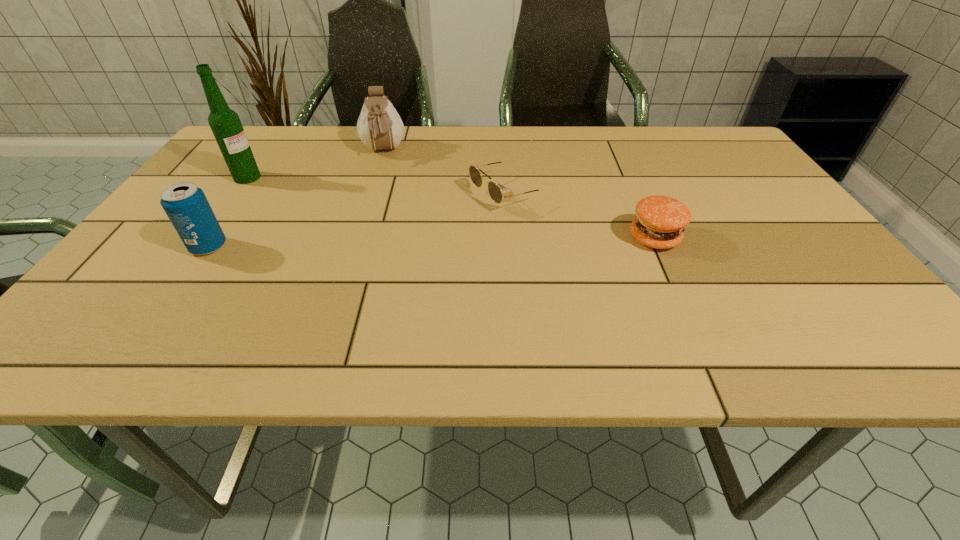
Locate an element on the screen. This screenshot has width=960, height=540. the third shortest object is located at coordinates (185, 204).

Where is `the rightmost object`? The height and width of the screenshot is (540, 960). the rightmost object is located at coordinates (660, 221).

The height and width of the screenshot is (540, 960). Find the location of `sunglasses`. sunglasses is located at coordinates (494, 190).

In order to click on pouch in this screenshot , I will do `click(379, 126)`.

Locate an element on the screen. Image resolution: width=960 pixels, height=540 pixels. the third object from right to left is located at coordinates (379, 126).

Find the location of a particular element. The width and height of the screenshot is (960, 540). the tallest object is located at coordinates (225, 123).

Locate an element on the screen. The height and width of the screenshot is (540, 960). free spot located on the front of the soda can is located at coordinates (160, 316).

Identify the location of free space located 0.210m on the left of the patty. Image resolution: width=960 pixels, height=540 pixels. (534, 238).

Locate an element on the screen. vacant region located on the front lenses of the second object from right to left is located at coordinates click(x=448, y=215).

Locate an element on the screen. This screenshot has width=960, height=540. vacant space positioned 0.270m on the front lenses of the second object from right to left is located at coordinates coord(368,246).